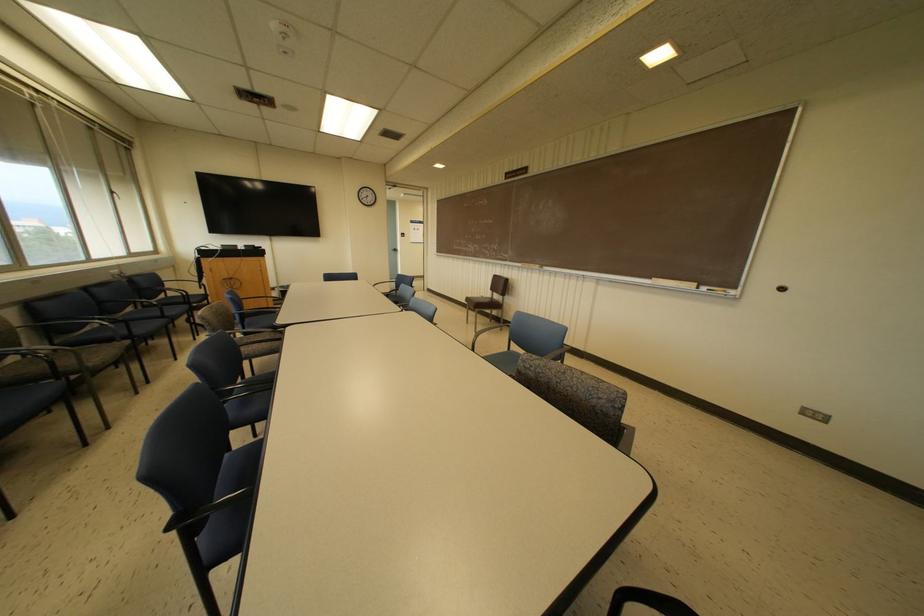
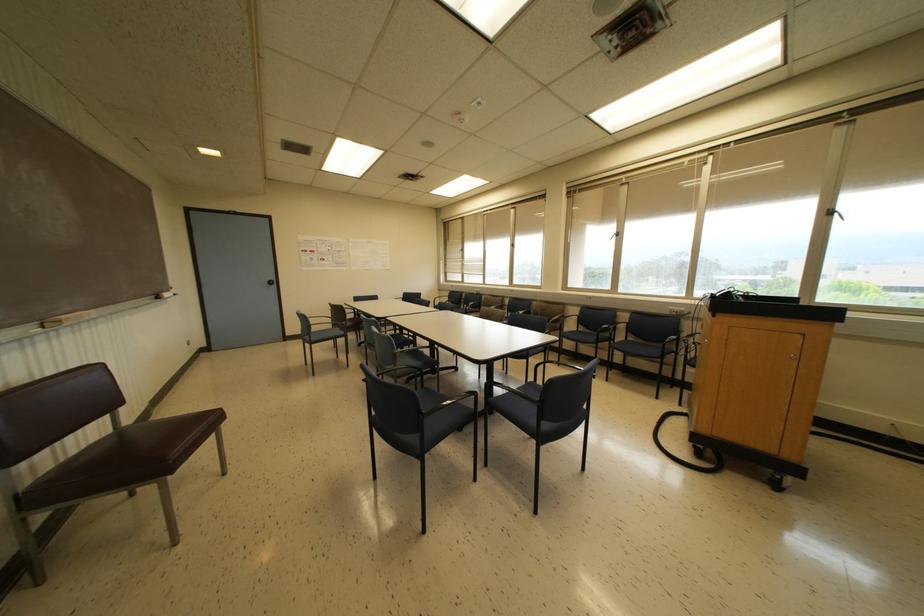
Where in the second image is the point corresponding to (x=112, y=192) from the first image?

(827, 213)